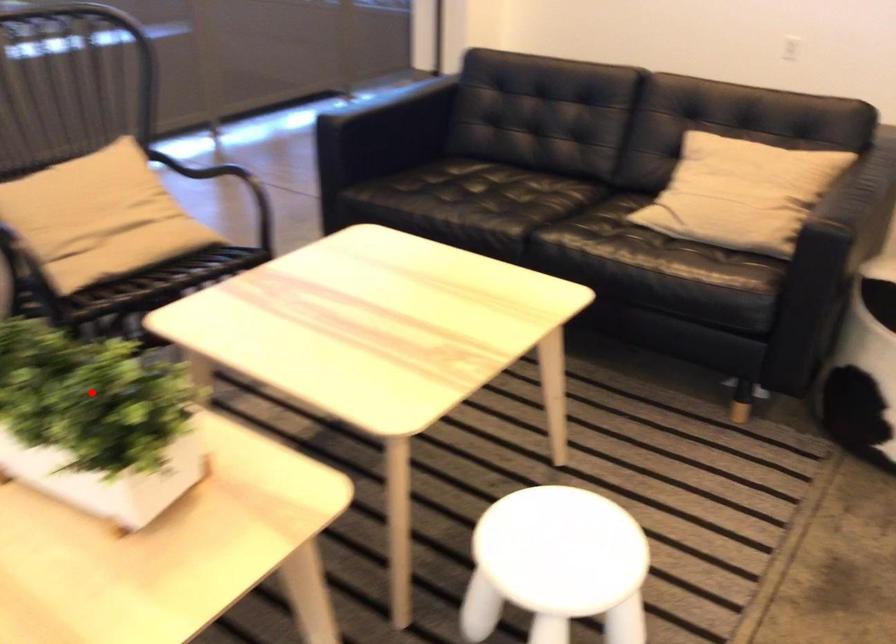
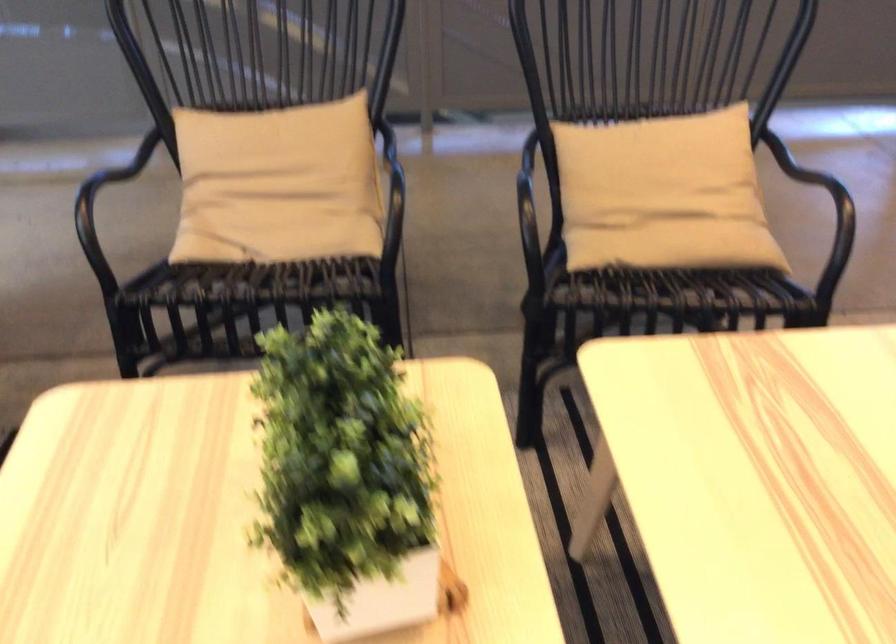
Locate, in the second image, the point that corresponds to the highlighted location in the first image.

(346, 477)